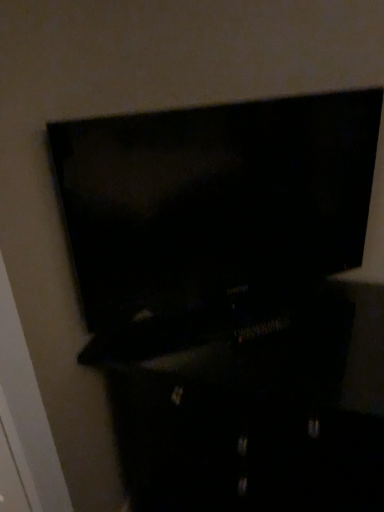
Locate an element on the screen. This screenshot has width=384, height=512. vacant space underneath matte black tv at upper center (from a real-world perspective) is located at coordinates (173, 331).